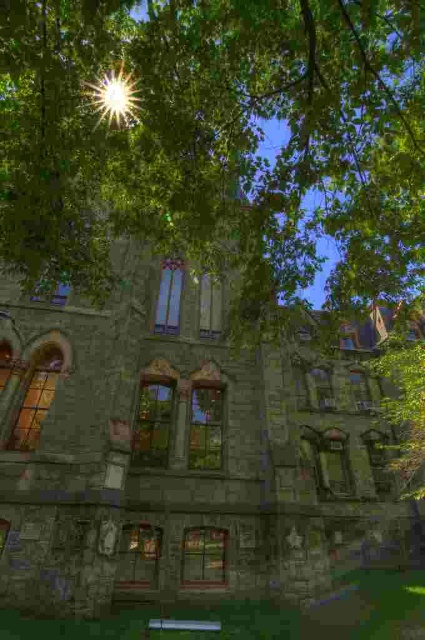
You are standing in front of the historic stone building and notice the green leafy tree at center and the bright sun at upper center. Which object is higher in the scene?

The green leafy tree at center is taller than the bright sun at upper center.

You are standing in front of the historic stone building and notice two points marked on the ground. The first point is at coordinate point(x=113, y=138) and the second point is at point(x=121, y=92). If you walk from the first point to the second point, will you be moving closer to or farther away from the building?

Moving from point(x=113, y=138) to point(x=121, y=92) would mean you are moving closer to the building because point(x=113, y=138) is behind point(x=121, y=92), indicating that the second point is closer to the building.